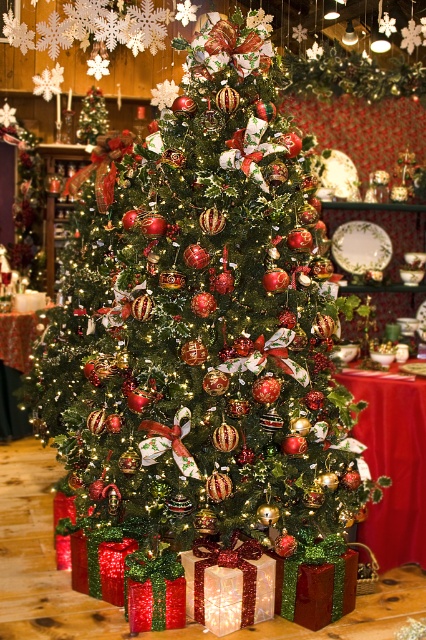
Can you confirm if shiny metallic ornaments at center is taller than red cloth table at center?

Yes.

Is shiny metallic ornaments at center smaller than red cloth table at center?

No.

Does point (219, 145) come in front of point (377, 403)?

Yes, it is.

Where is `shiny metallic ornaments at center`? shiny metallic ornaments at center is located at coordinates (203, 326).